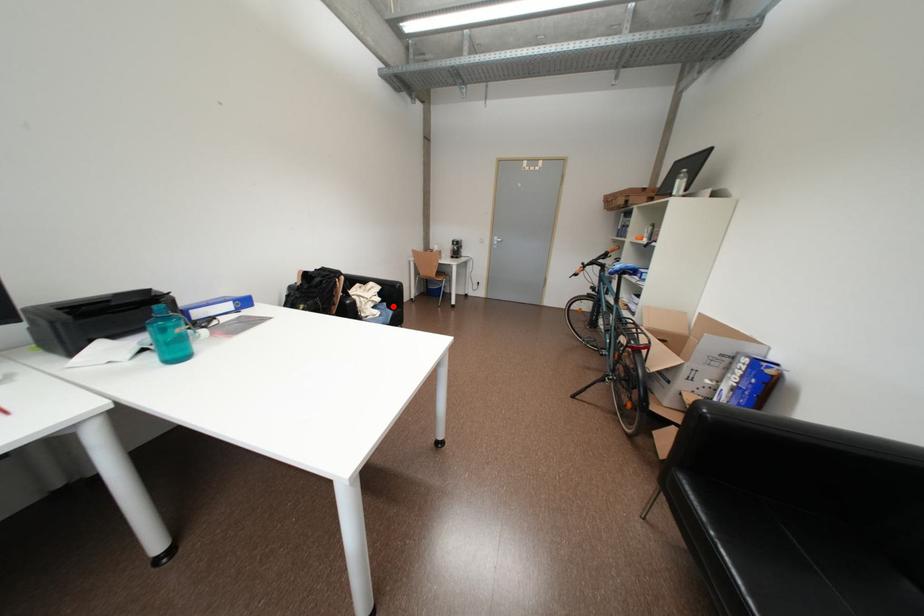
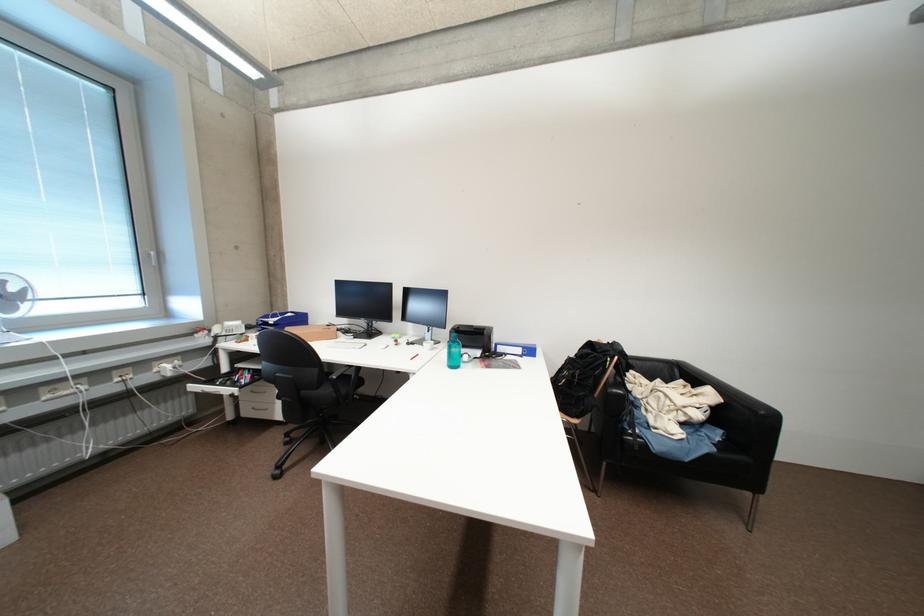
Question: I am providing you with two images of the same scene from different viewpoints. Given a red point in image1, look at the same physical point in image2. Is it:

Choices:
 (A) Closer to the viewpoint
 (B) Farther from the viewpoint

Answer: (B)